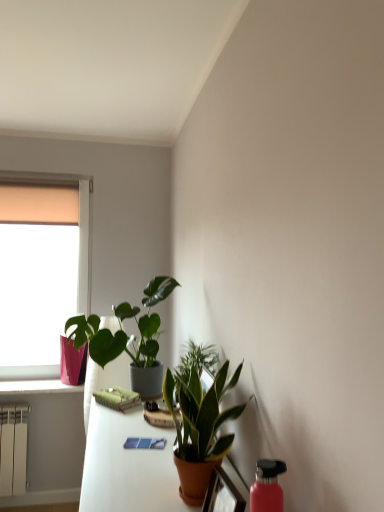
Question: From the image's perspective, is pink glossy flowerpot at lower left above or below orange fabric curtain at upper left?

Choices:
 (A) above
 (B) below

Answer: (B)

Question: Does point (67, 373) appear closer or farther from the camera than point (11, 194)?

Choices:
 (A) farther
 (B) closer

Answer: (B)

Question: Considering the real-world distances, which object is closest to the matte orange pot at lower center?

Choices:
 (A) pink matte water bottle at lower right
 (B) terracotta ceramic table at center
 (C) orange fabric curtain at upper left
 (D) pink plastic window sill at left
 (E) green matte plant at upper center, which ranks as the second houseplant in right-to-left order

Answer: (A)

Question: Considering the real-world distances, which object is closest to the matte orange pot at lower center?

Choices:
 (A) orange fabric curtain at upper left
 (B) matte pink vase at left
 (C) pink matte water bottle at lower right
 (D) pink plastic window sill at left
 (E) green glossy houseplant at center, the second houseplant from the left

Answer: (E)